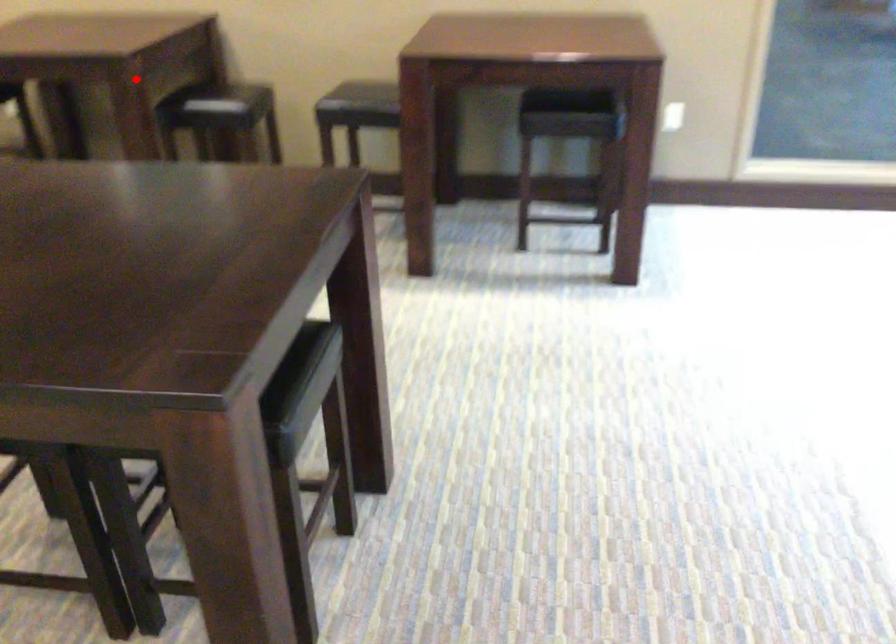
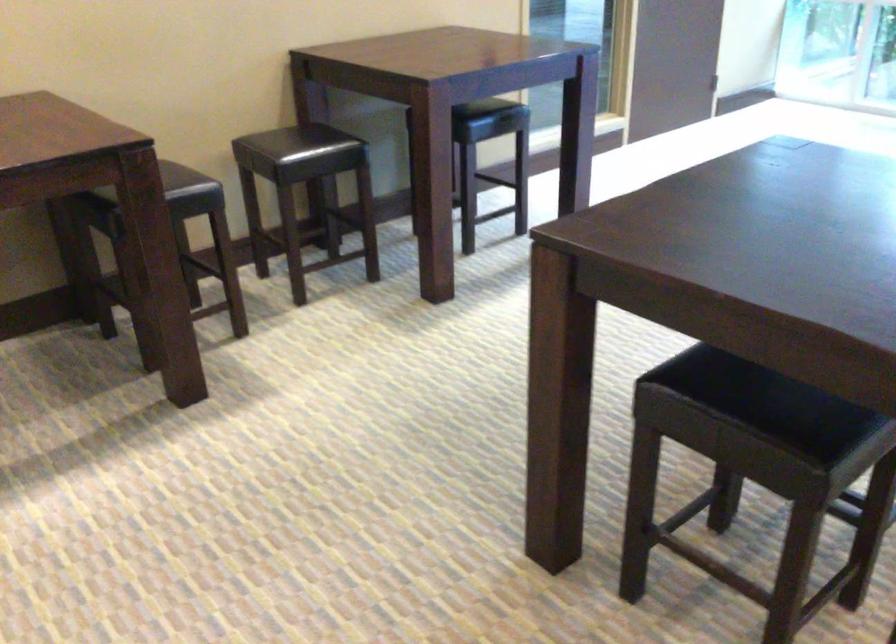
Question: I am providing you with two images of the same scene from different viewpoints. Given a red point in image1, look at the same physical point in image2. Is it:

Choices:
 (A) Closer to the viewpoint
 (B) Farther from the viewpoint

Answer: (A)